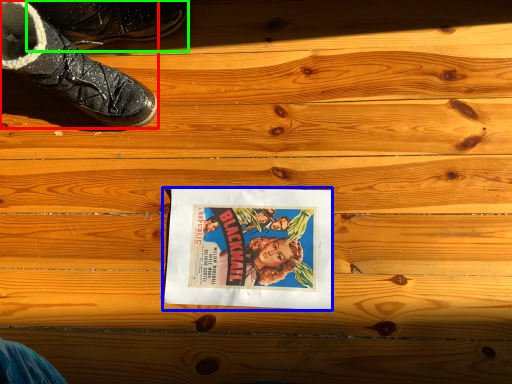
Question: Based on their relative distances, which object is farther from footwear (highlighted by a red box)? Choose from movie poster (highlighted by a blue box) and footwear (highlighted by a green box).

Choices:
 (A) movie poster
 (B) footwear

Answer: (A)